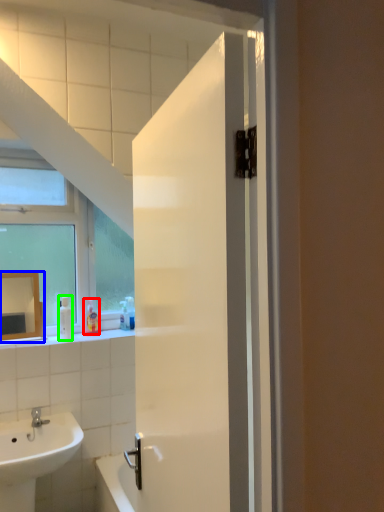
Question: Estimate the real-world distances between objects in this image. Which object is farther from toiletry (highlighted by a red box), mirror (highlighted by a blue box) or soap dispenser (highlighted by a green box)?

Choices:
 (A) mirror
 (B) soap dispenser

Answer: (A)